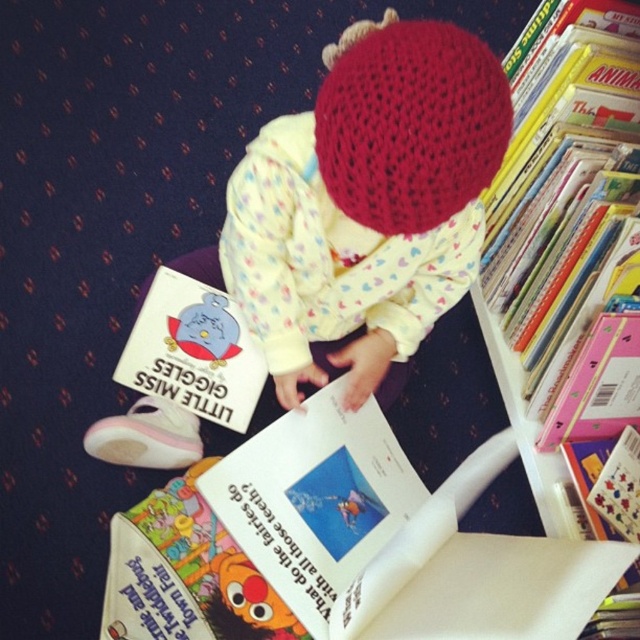
You are a drone flying above the scene. You need to deliver a small package to one of the two points. Which point is closer to you, point (250, 321) or point (512, 323)?

Point (250, 321) is closer to the viewer than point (512, 323), so the drone should deliver the package to point (250, 321) as it is nearer.

You are a parent trying to organize the child room. You see the knitted wool hat at center and the white plastic bookshelf at upper right. Which object is located higher in the image?

The knitted wool hat at center is positioned over the white plastic bookshelf at upper right, so it is higher in the image.

You are a toy delivery person who needs to place a new toy on the white plastic bookshelf at upper right. The toy is as big as the knitted wool hat at center. Will the toy fit on the bookshelf?

The knitted wool hat at center has a larger size compared to white plastic bookshelf at upper right. Since the toy is as big as the knitted wool hat at center, it may not fit on the bookshelf because the hat is larger than the bookshelf itself.